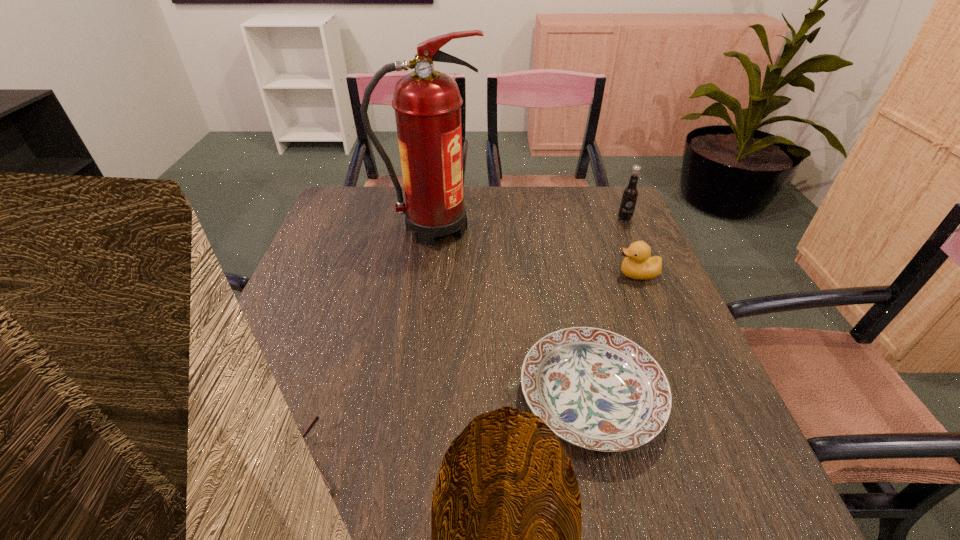
Where is `fire extinguisher`? The image size is (960, 540). fire extinguisher is located at coordinates pyautogui.click(x=427, y=103).

Locate an element on the screen. The height and width of the screenshot is (540, 960). root beer is located at coordinates (630, 194).

The width and height of the screenshot is (960, 540). I want to click on the third nearest object, so click(638, 265).

You are a GUI agent. You are given a task and a screenshot of the screen. Output one action in this format:
    pyautogui.click(x=<x>, y=<y>)
    Task: Click on the duckling
    
    Given the screenshot: What is the action you would take?
    pyautogui.click(x=638, y=265)

The width and height of the screenshot is (960, 540). I want to click on plate, so click(596, 389).

Identify the location of spectacles. (316, 418).

Find the location of a particular element. This screenshot has width=960, height=540. vacant region located 0.320m on the front-facing side of the fire extinguisher is located at coordinates (593, 228).

You are a GUI agent. You are given a task and a screenshot of the screen. Output one action in this format:
    pyautogui.click(x=<x>, y=<y>)
    Task: Click on the free space located 0.250m on the label of the root beer
    
    Given the screenshot: What is the action you would take?
    pyautogui.click(x=651, y=279)

Locate an element on the screen. This screenshot has height=540, width=960. vacant area situated 0.120m on the face of the duckling is located at coordinates (569, 274).

This screenshot has width=960, height=540. Identify the location of vacant area located 0.240m on the face of the duckling. (522, 274).